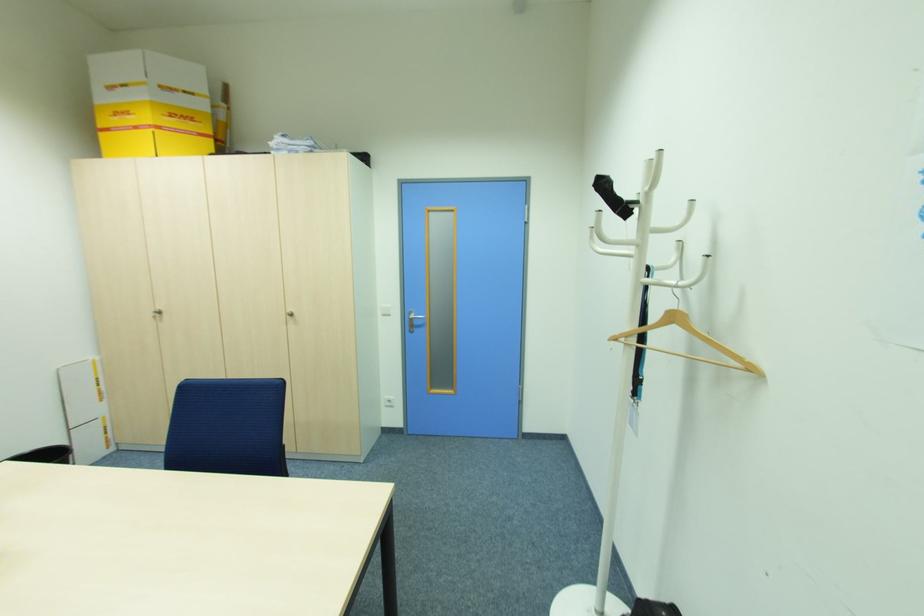
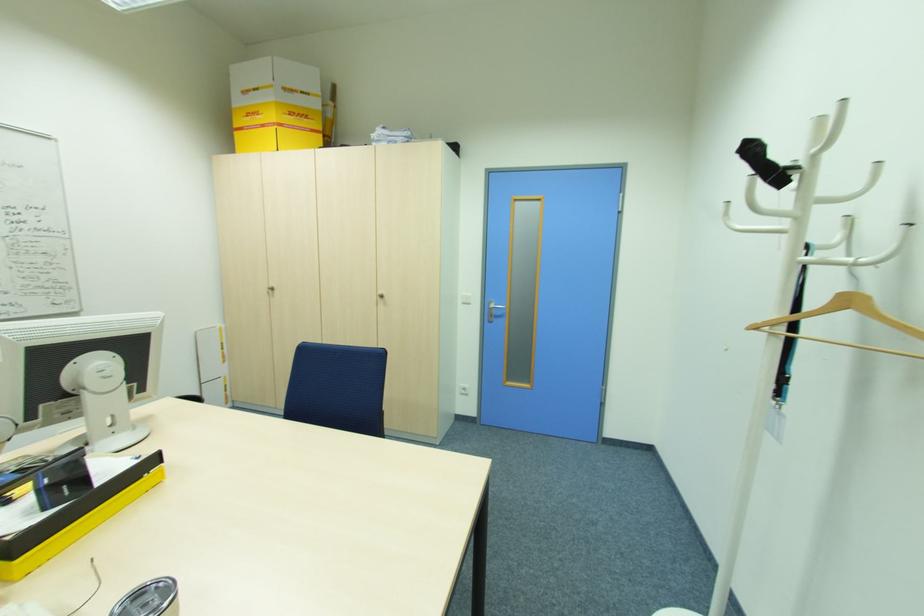
Question: How did the camera likely rotate?

Choices:
 (A) Left
 (B) Right
 (C) Up
 (D) Down

Answer: (A)